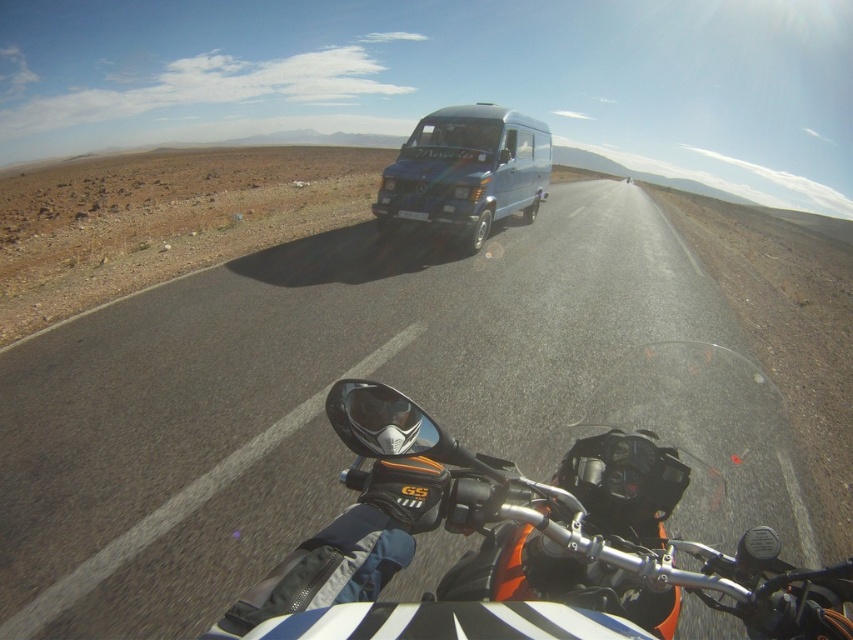
You are the motorcyclist in the image and want to know how far the point at coordinates point (x=281, y=627) is from you. Can you determine the distance in inches?

The point at coordinates point (x=281, y=627) is 34.89 inches from the viewer.

You are riding a motorcycle and see the asphalt road at center. Based on its position, can you estimate where the road is heading in relation to your current direction?

The asphalt road at center is located at point coordinates, so it continues straight ahead in your current direction.

You are riding the orange matte motorcycle at center on the asphalt road at center. You need to make a quick turn to avoid an obstacle. Considering the road and motorcycle widths, which direction would allow you to maneuver more easily?

The asphalt road at center is wider than the orange matte motorcycle at center, so you can maneuver more easily in either direction as there is sufficient space on both sides of the motorcycle.